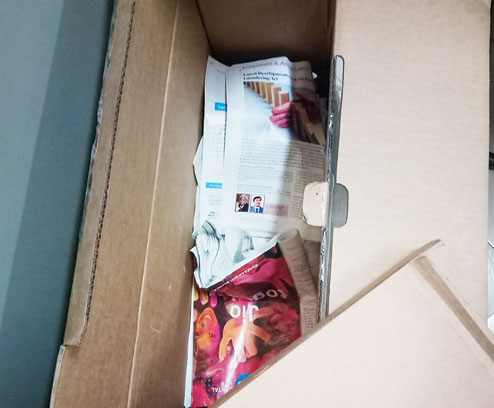
Where is `magazines`? magazines is located at coordinates (268, 123), (249, 318).